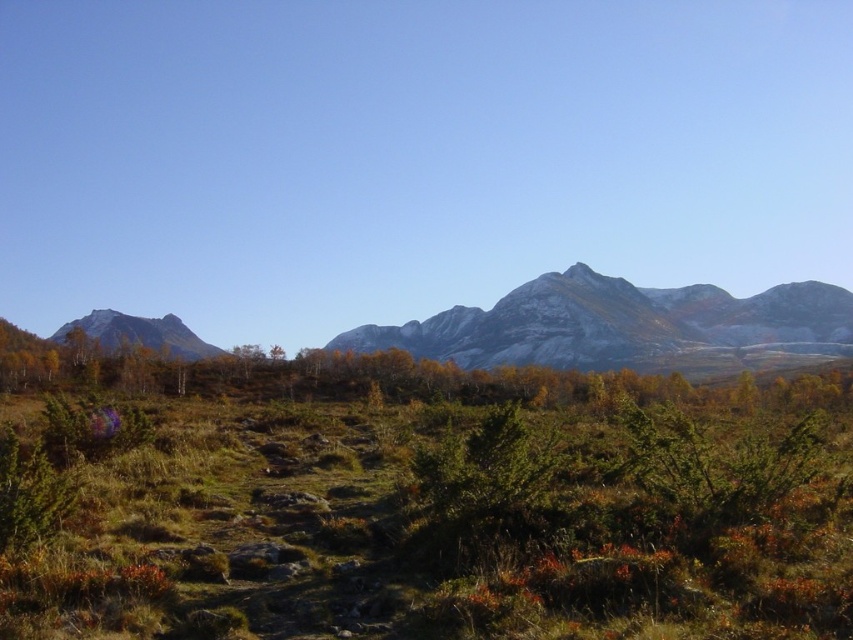
You are planning to take a photo of the rocky gray mountain range at center and the smooth gray rock at left. Which object should you focus on first if you want to capture both in a single frame without moving your camera?

You should focus on the rocky gray mountain range at center first because it is wider than the smooth gray rock at left, so it will occupy more space in the frame.

You are standing at the origin point of the coordinate system in this landscape. You want to place a new decorative rock at the exact location of the green leafy shrub at center. What are the coordinates where you should place the rock?

The coordinates for placing the decorative rock should be at point [294,372], as that is the exact location of the green leafy shrub at center.